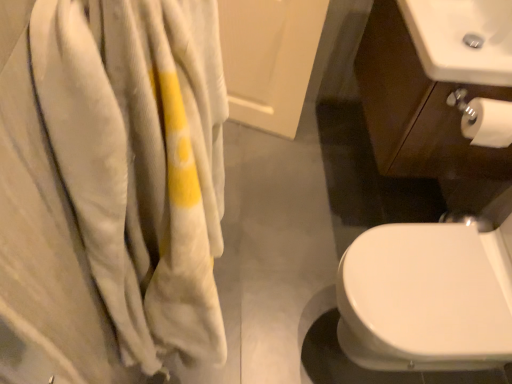
Question: Is point (472, 109) closer or farther from the camera than point (177, 284)?

Choices:
 (A) farther
 (B) closer

Answer: (A)

Question: Considering the positions of white matte toilet paper at lower right and soft white towel at left in the image, is white matte toilet paper at lower right taller or shorter than soft white towel at left?

Choices:
 (A) short
 (B) tall

Answer: (A)

Question: Which object is the farthest from the soft white towel at left?

Choices:
 (A) white glossy sink at lower right, the 2th sink when ordered from top to bottom
 (B) white glossy sink at upper right, marked as the second sink in a front-to-back arrangement
 (C) white matte toilet paper at lower right

Answer: (C)

Question: Considering the real-world distances, which object is farthest from the white matte toilet paper at lower right?

Choices:
 (A) white glossy sink at lower right, the 1th sink when ordered from front to back
 (B) soft white towel at left
 (C) white glossy sink at upper right, which is counted as the second sink, starting from the bottom

Answer: (B)